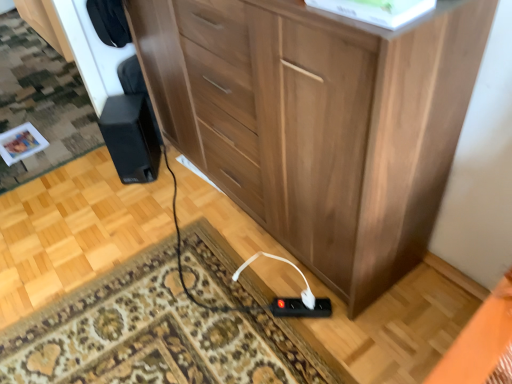
Identify the location of free area in between black matte speaker at lower left and black plastic power strip at lower center, which is counted as the 2th plug, starting from the right. The height and width of the screenshot is (384, 512). (209, 228).